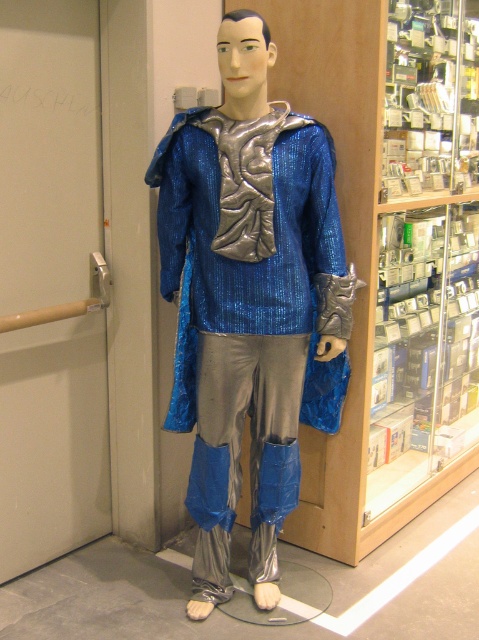
Question: Can you confirm if shiny metallic suit at center is smaller than clear glass display case at center right?

Choices:
 (A) no
 (B) yes

Answer: (B)

Question: Is shiny metallic suit at center to the left of clear glass display case at center right from the viewer's perspective?

Choices:
 (A) yes
 (B) no

Answer: (A)

Question: Which point is farther to the camera?

Choices:
 (A) clear glass display case at center right
 (B) shiny metallic suit at center

Answer: (A)

Question: Does shiny metallic suit at center come behind clear glass display case at center right?

Choices:
 (A) yes
 (B) no

Answer: (B)